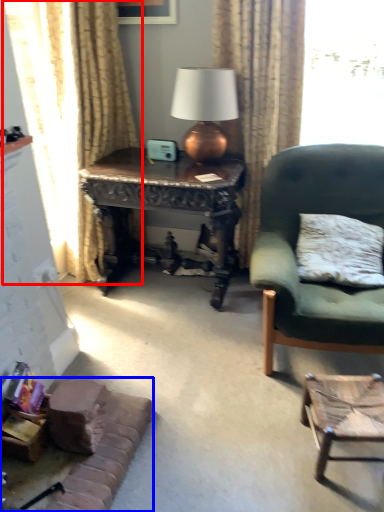
Question: Which of the following is the farthest to the observer, curtain (highlighted by a red box) or couch (highlighted by a blue box)?

Choices:
 (A) curtain
 (B) couch

Answer: (A)